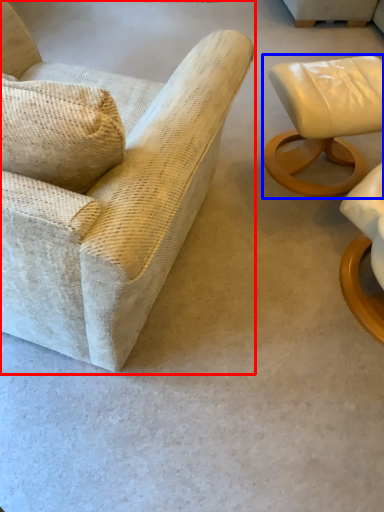
Question: Among these objects, which one is farthest to the camera, chair (highlighted by a red box) or chair (highlighted by a blue box)?

Choices:
 (A) chair
 (B) chair

Answer: (B)